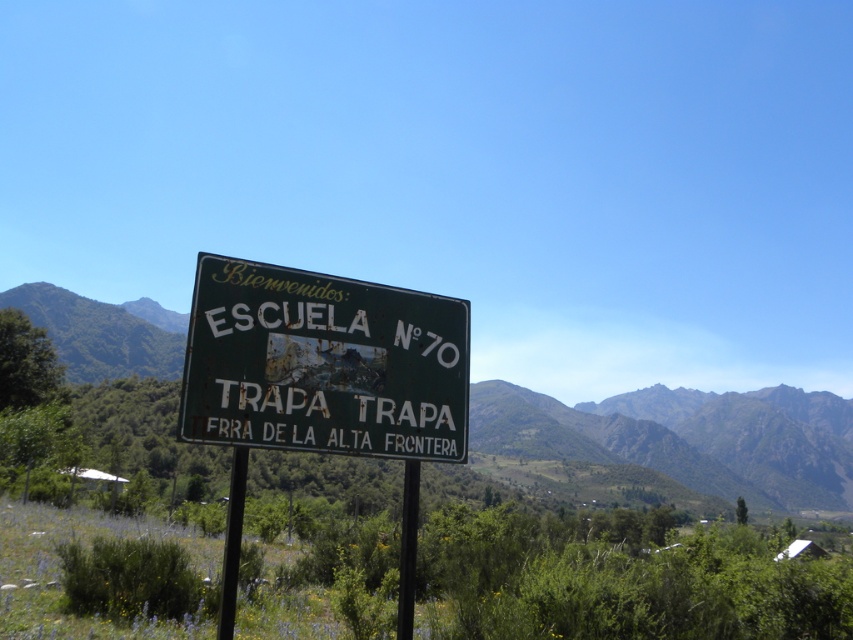
You are a hiker standing at the base of the green grassy mountain at center and the metallic pole at center. Which object is higher in elevation?

The metallic pole at center is higher in elevation than the green grassy mountain at center because the green grassy mountain at center is located below it.

You are a hiker who wants to take a photo of the rusty metal sign at center and the green grassy mountain at center. Which object should you focus on first if you want to include both in your photo without moving your camera position?

You should focus on the green grassy mountain at center first because the rusty metal sign at center is shorter than it, allowing both to be in frame without adjusting the camera position.

You are standing in front of the green signboard in the scene. There is a point at coordinates (323,364). What does this point indicate?

The point at coordinates (323,364) indicates the rusty metal sign at center.